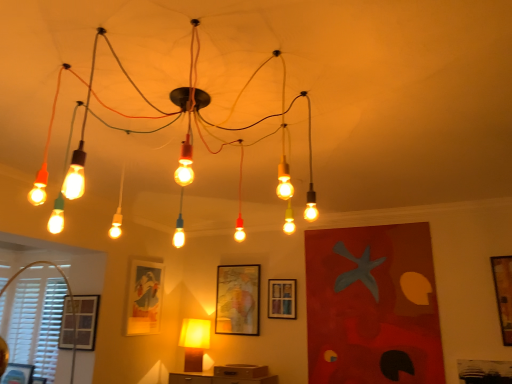
Question: From the image's perspective, is matte glass light fixture at center, which is the second lamp in back-to-front order, over matte glass picture frame at center left, which appears as the fourth picture frame when viewed from the right?

Choices:
 (A) no
 (B) yes

Answer: (B)

Question: Is matte glass light fixture at center, the second lamp when ordered from bottom to top, not inside matte glass picture frame at center left, arranged as the third picture frame when viewed from the left?

Choices:
 (A) no
 (B) yes

Answer: (B)

Question: Does matte glass light fixture at center, the 1th lamp viewed from the front, contain matte glass picture frame at center left, which appears as the fourth picture frame when viewed from the right?

Choices:
 (A) yes
 (B) no

Answer: (B)

Question: Is matte glass light fixture at center, the first lamp when ordered from top to bottom, at the right side of matte glass picture frame at center left, which appears as the fourth picture frame when viewed from the right?

Choices:
 (A) no
 (B) yes

Answer: (B)

Question: Considering the relative sizes of matte glass light fixture at center, the second lamp when ordered from bottom to top, and matte glass picture frame at center left, which appears as the fourth picture frame when viewed from the right, in the image provided, is matte glass light fixture at center, the second lamp when ordered from bottom to top, bigger than matte glass picture frame at center left, which appears as the fourth picture frame when viewed from the right,?

Choices:
 (A) yes
 (B) no

Answer: (A)

Question: From their relative heights in the image, would you say matte yellow lamp at center, the second lamp positioned from the top, is taller or shorter than white plastic blinds at lower left?

Choices:
 (A) short
 (B) tall

Answer: (A)

Question: From the image's perspective, is matte yellow lamp at center, which appears as the 2th lamp when viewed from the front, above or below white plastic blinds at lower left?

Choices:
 (A) below
 (B) above

Answer: (A)

Question: Based on their positions, is matte yellow lamp at center, the second lamp positioned from the top, located to the left or right of white plastic blinds at lower left?

Choices:
 (A) left
 (B) right

Answer: (B)

Question: Considering their positions, is matte yellow lamp at center, which appears as the first lamp when ordered from the bottom, located in front of or behind white plastic blinds at lower left?

Choices:
 (A) behind
 (B) front

Answer: (A)

Question: From the image's perspective, is matte yellow lamp at center, arranged as the 1th lamp when viewed from the back, above or below wooden framed map at center, which is the 4th picture frame in left-to-right order?

Choices:
 (A) above
 (B) below

Answer: (B)

Question: Is matte yellow lamp at center, which appears as the 2th lamp when viewed from the front, taller or shorter than wooden framed map at center, which is the 4th picture frame in left-to-right order?

Choices:
 (A) short
 (B) tall

Answer: (A)

Question: Do you think matte yellow lamp at center, arranged as the 1th lamp when viewed from the back, is within wooden framed map at center, marked as the 3th picture frame in a right-to-left arrangement, or outside of it?

Choices:
 (A) outside
 (B) inside

Answer: (A)

Question: Is matte yellow lamp at center, arranged as the 1th lamp when viewed from the back, bigger or smaller than wooden framed map at center, marked as the 3th picture frame in a right-to-left arrangement?

Choices:
 (A) big
 (B) small

Answer: (A)

Question: Does point (73, 299) appear closer or farther from the camera than point (158, 316)?

Choices:
 (A) farther
 (B) closer

Answer: (B)

Question: From a real-world perspective, is white plastic blinds at lower left positioned above or below matte glass picture frame at center left, which appears as the fourth picture frame when viewed from the right?

Choices:
 (A) above
 (B) below

Answer: (B)